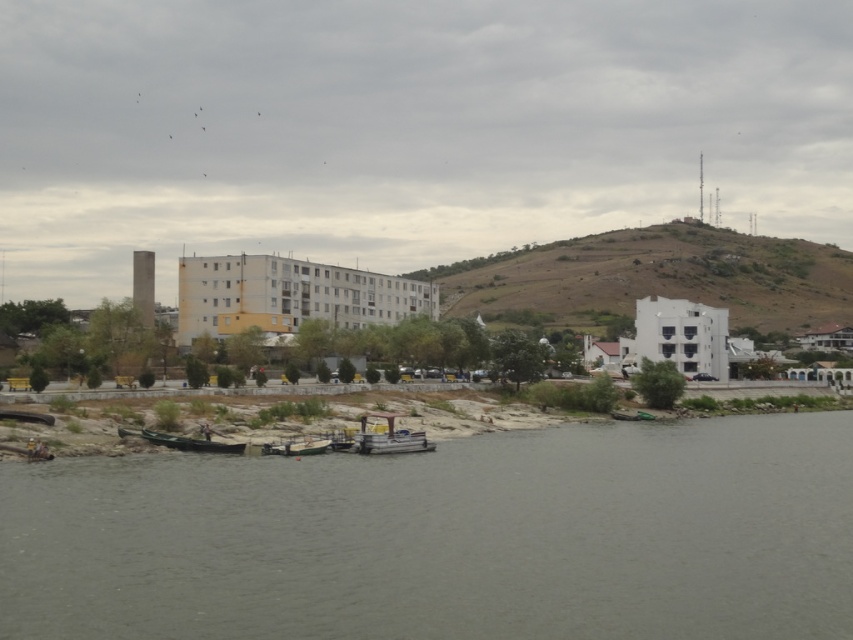
You are standing at the point with coordinates point (300, 449) and want to walk to the point with coordinates point (817, 284). Which direction should you move relative to your current position?

You should move backward because point (817, 284) is behind point (300, 449).

You are planning to transport a large cargo container that requires a boat wider than 3 meters. You have access to both the metallic gray boat at center and the wooden boat at lower center. Which boat should you choose?

The metallic gray boat at center has a greater width than the wooden boat at lower center. Since the cargo container requires a boat wider than 3 meters, you should choose the metallic gray boat at center if its width meets or exceeds the required 3 meters. However, the exact width isn not provided, so this recommendation assumes it is sufficiently wide.

You are standing on the riverside path and see the gray concrete river at lower center and the metallic gray boat at center. Which object is located below the other?

The gray concrete river at lower center is positioned under the metallic gray boat at center.